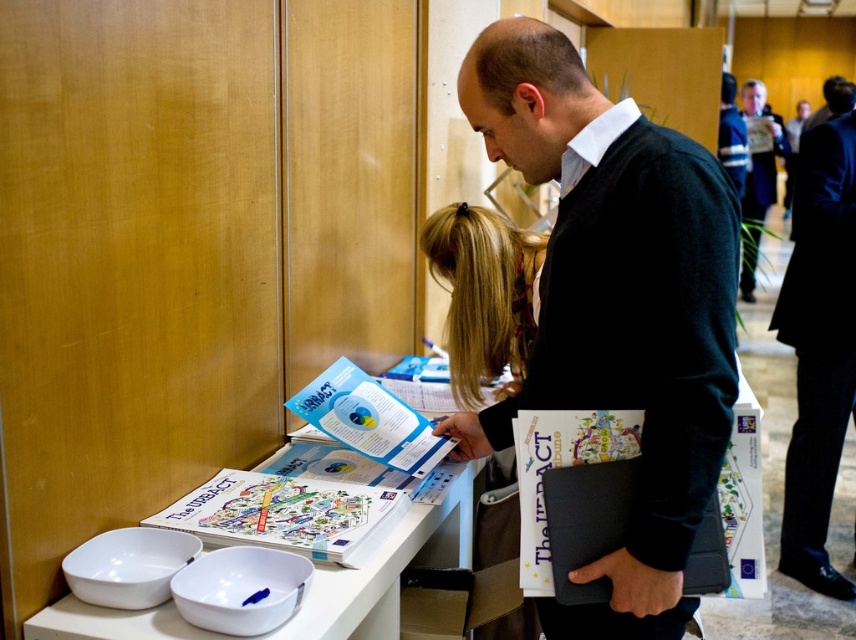
Does black suit at right have a lesser width compared to blonde hair at center?

No, black suit at right is not thinner than blonde hair at center.

Is black suit at right bigger than blonde hair at center?

Yes, black suit at right is bigger than blonde hair at center.

This screenshot has height=640, width=856. I want to click on black suit at right, so click(818, 346).

Does black sweater at center have a greater width compared to dark blue suit at upper right?

In fact, black sweater at center might be narrower than dark blue suit at upper right.

What are the coordinates of `black sweater at center` in the screenshot? It's located at (615, 305).

Between black sweater at center and black suit at right, which one appears on the left side from the viewer's perspective?

Positioned to the left is black sweater at center.

Is point (646, 380) in front of point (786, 490)?

Yes, it is.

Identify the location of black sweater at center. The height and width of the screenshot is (640, 856). (615, 305).

This screenshot has width=856, height=640. In order to click on black sweater at center in this screenshot , I will do `click(615, 305)`.